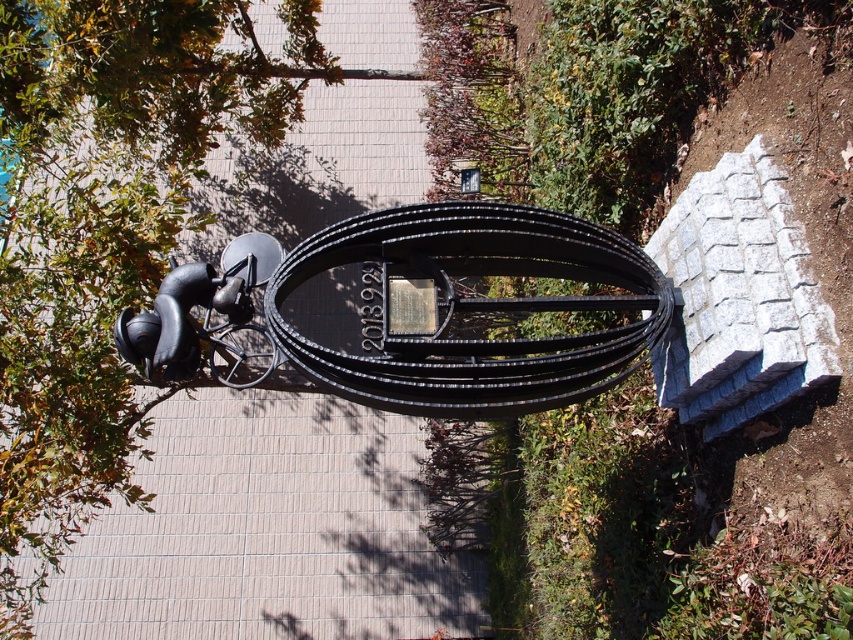
Question: Considering the relative positions of green leafy tree at upper left and black metallic cable at center in the image provided, where is green leafy tree at upper left located with respect to black metallic cable at center?

Choices:
 (A) below
 (B) above

Answer: (B)

Question: Does green leafy tree at upper left lie behind black metallic cable at center?

Choices:
 (A) no
 (B) yes

Answer: (B)

Question: Which of the following is the farthest from the observer?

Choices:
 (A) black metallic cable at center
 (B) green leafy tree at upper left

Answer: (B)

Question: Where is green leafy tree at upper left located in relation to black metallic cable at center in the image?

Choices:
 (A) left
 (B) right

Answer: (A)